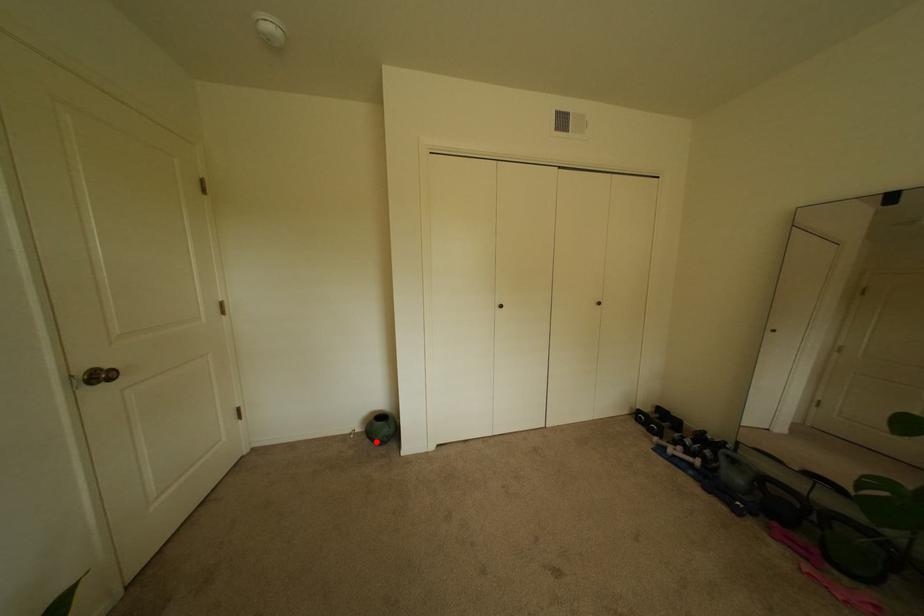
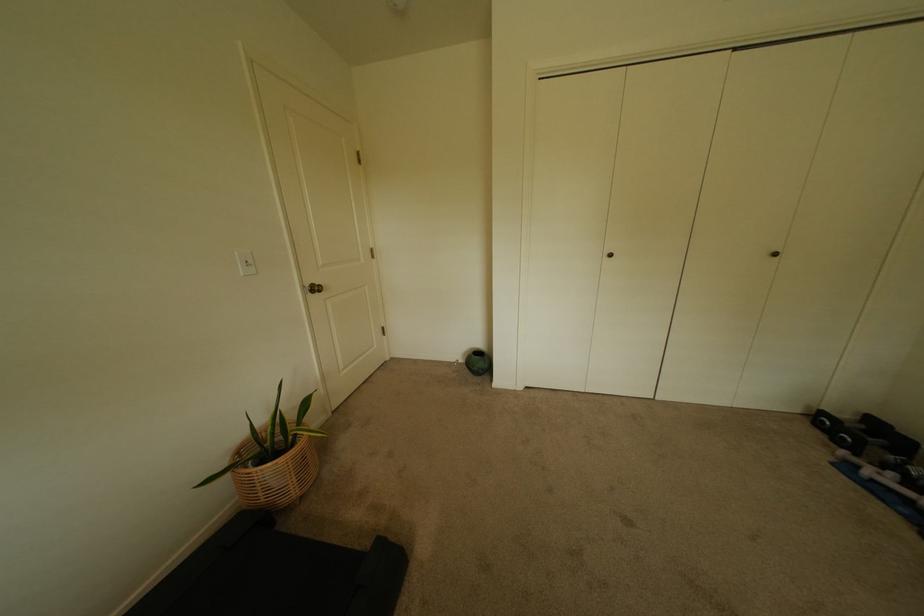
The point at the highlighted location is marked in the first image. Where is the corresponding point in the second image?

(476, 371)